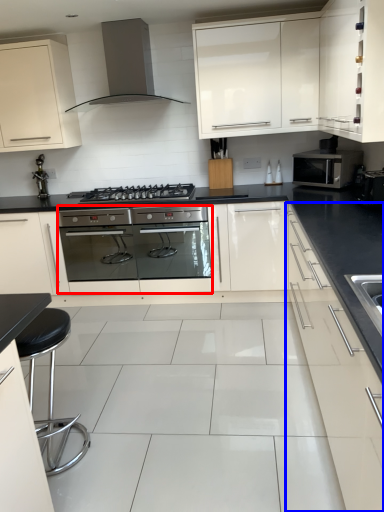
Question: Which object is closer to the camera taking this photo, oven (highlighted by a red box) or cabinetry (highlighted by a blue box)?

Choices:
 (A) oven
 (B) cabinetry

Answer: (B)